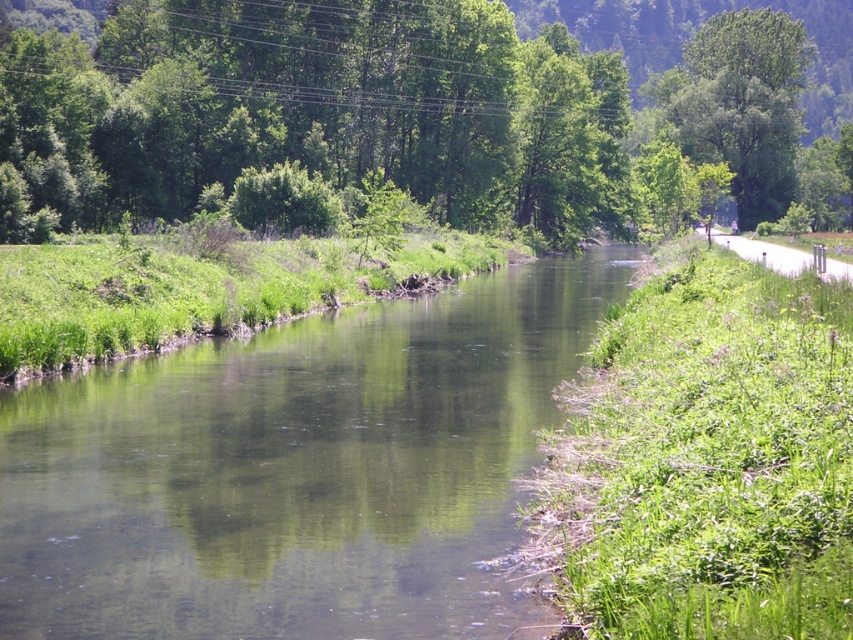
Between green leafy tree at upper center and green leafy tree at upper right, which one has less height?

green leafy tree at upper right

Image resolution: width=853 pixels, height=640 pixels. I want to click on green leafy tree at upper center, so click(397, 109).

The image size is (853, 640). What are the coordinates of `green leafy tree at upper center` in the screenshot? It's located at (397, 109).

At what (x,y) coordinates should I click in order to perform the action: click on green leafy tree at upper center. Please return your answer as a coordinate pair (x, y). The image size is (853, 640). Looking at the image, I should click on (397, 109).

Between green water at center and green leafy tree at upper center, which one has less height?

With less height is green water at center.

Can you confirm if green water at center is positioned to the right of green leafy tree at upper center?

No, green water at center is not to the right of green leafy tree at upper center.

Identify the location of green water at center. (299, 470).

Which is in front, point (97, 477) or point (799, 26)?

Positioned in front is point (97, 477).

Based on the photo, who is shorter, green water at center or green leafy tree at upper right?

Standing shorter between the two is green water at center.

Find the location of `green water at center`. green water at center is located at coordinates (299, 470).

You are a GUI agent. You are given a task and a screenshot of the screen. Output one action in this format:
    pyautogui.click(x=<x>, y=<y>)
    Task: Click on the green water at center
    
    Given the screenshot: What is the action you would take?
    pyautogui.click(x=299, y=470)